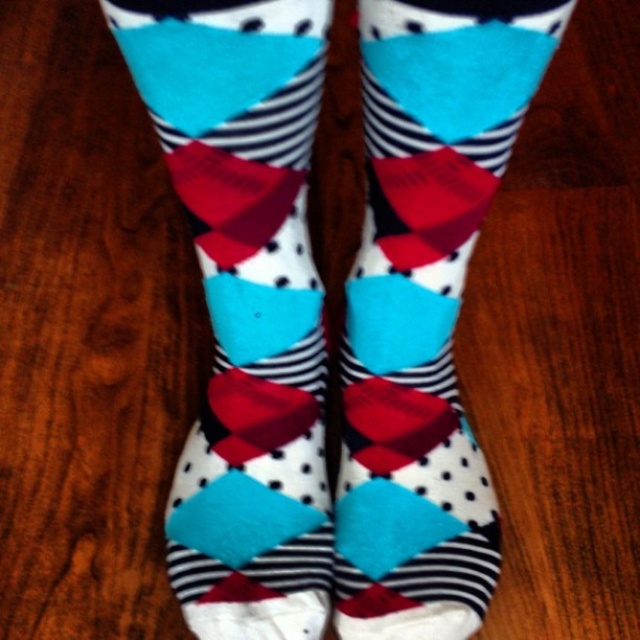
Can you confirm if matte cotton socks at center is positioned below cotton socks at center?

No, matte cotton socks at center is not below cotton socks at center.

Is point (301, 278) farther from viewer compared to point (346, 449)?

No, (301, 278) is in front of (346, 449).

Identify the location of matte cotton socks at center. This screenshot has height=640, width=640. (244, 305).